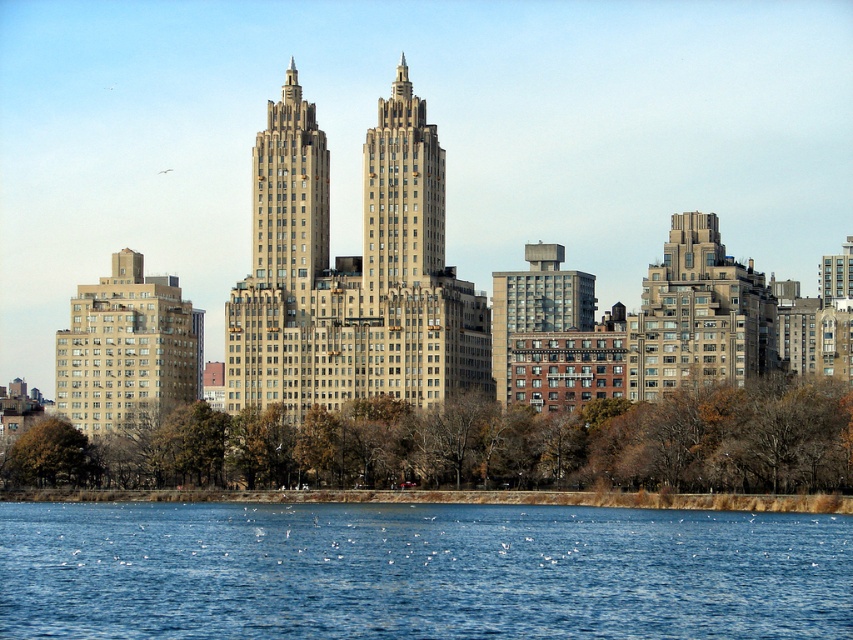
You are a photographer planning to capture the entire scene in one shot. Given that the blue liquid water at lower center and the beige stone twin towers at center are both visible, which object occupies more area in the photo?

The blue liquid water at lower center occupies more area in the photo because it is larger in size than the beige stone twin towers at center according to the description.

You are a drone operator who needs to fly a drone from the blue liquid water at lower center to the beige stone twin towers at center. Considering the height difference between them, can the drone take off from the water and reach the towers without any obstacles?

The blue liquid water at lower center is shorter than beige stone twin towers at center, so the drone can take off from the water and reach the towers as there is no height obstruction mentioned between them.